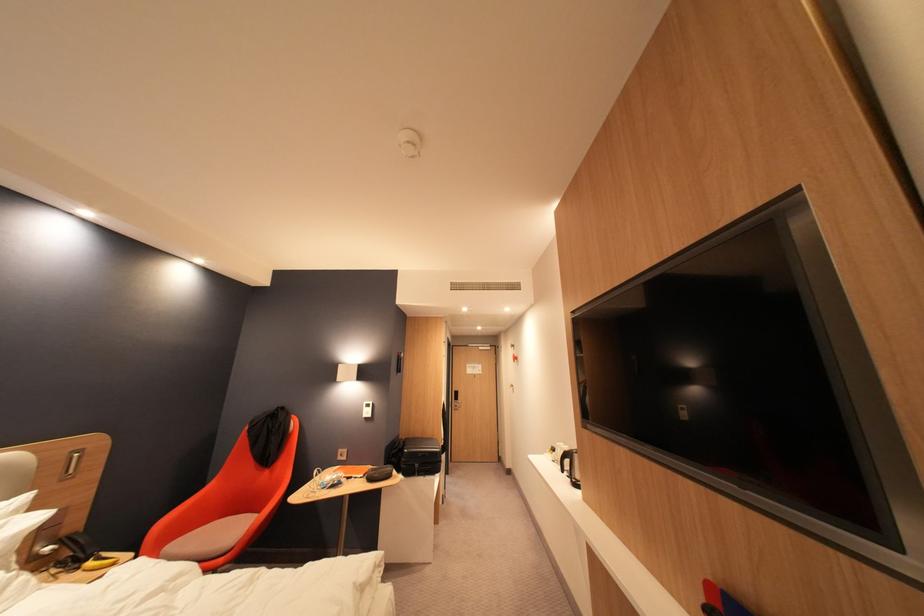
I want to click on suitcase handle, so click(x=419, y=467).